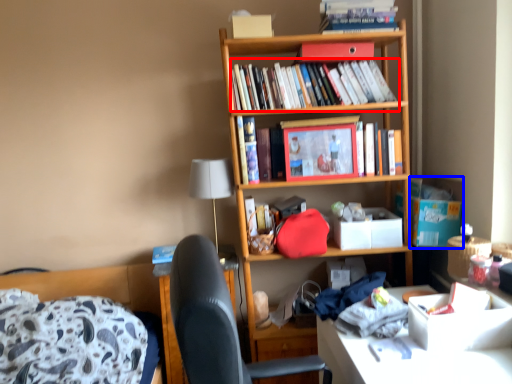
Question: Which object is further to the camera taking this photo, book (highlighted by a red box) or cardboard box (highlighted by a blue box)?

Choices:
 (A) book
 (B) cardboard box

Answer: (B)